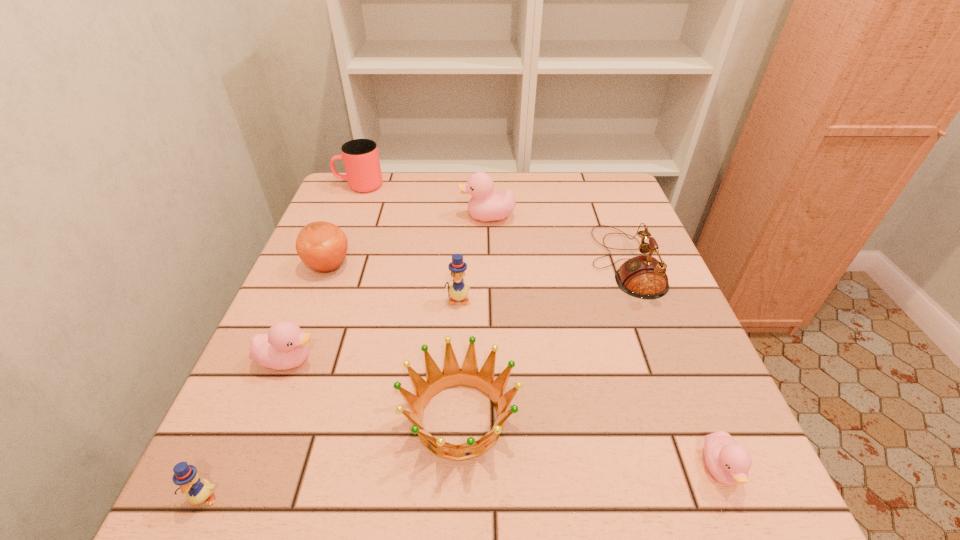
I want to click on golden crown, so click(468, 375).

The image size is (960, 540). Identify the location of the nearer yellow duckling. (186, 476).

You are a GUI agent. You are given a task and a screenshot of the screen. Output one action in this format:
    pyautogui.click(x=<x>, y=<y>)
    Task: Click on the left yellow duckling
    The height and width of the screenshot is (540, 960).
    Given the screenshot: What is the action you would take?
    pyautogui.click(x=186, y=476)

Locate an element on the screen. Image resolution: width=960 pixels, height=540 pixels. the shortest duckling is located at coordinates (729, 462).

You are a GUI agent. You are given a task and a screenshot of the screen. Output one action in this format:
    pyautogui.click(x=<x>, y=<y>)
    Task: Click on the rightmost pink duckling
    The width and height of the screenshot is (960, 540).
    Given the screenshot: What is the action you would take?
    (729, 462)

Where is `blank space located 0.310m on the front-facing side of the farthest pink duckling`? blank space located 0.310m on the front-facing side of the farthest pink duckling is located at coordinates (344, 218).

Find the location of `vacant space located on the front-facing side of the farthest pink duckling`. vacant space located on the front-facing side of the farthest pink duckling is located at coordinates (336, 218).

Where is `vacant space located 0.370m on the front-facing side of the farthest pink duckling`? The width and height of the screenshot is (960, 540). vacant space located 0.370m on the front-facing side of the farthest pink duckling is located at coordinates (322, 218).

Locate an element on the screen. The height and width of the screenshot is (540, 960). vacant region located on the face of the bigger yellow duckling, where the monocle is placed is located at coordinates (452, 403).

This screenshot has height=540, width=960. I want to click on free location located 0.330m on the right of the orange, so click(492, 266).